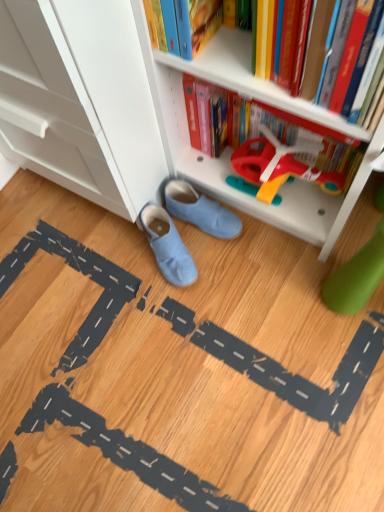
Image resolution: width=384 pixels, height=512 pixels. I want to click on free space in front of light blue suede shoes at center, which appears as the second footwear when viewed from the top, so click(x=185, y=329).